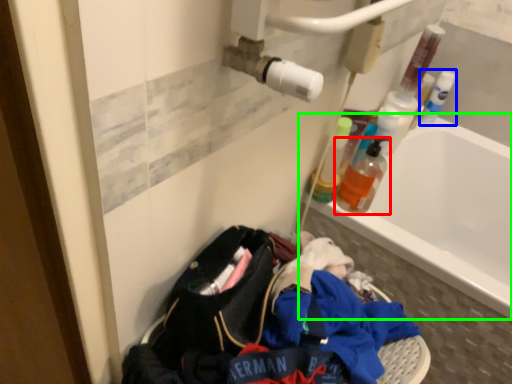
Question: Which object is the closest to the bottle (highlighted by a red box)? Choose among these: bottle (highlighted by a blue box) or bathtub (highlighted by a green box).

Choices:
 (A) bottle
 (B) bathtub

Answer: (B)